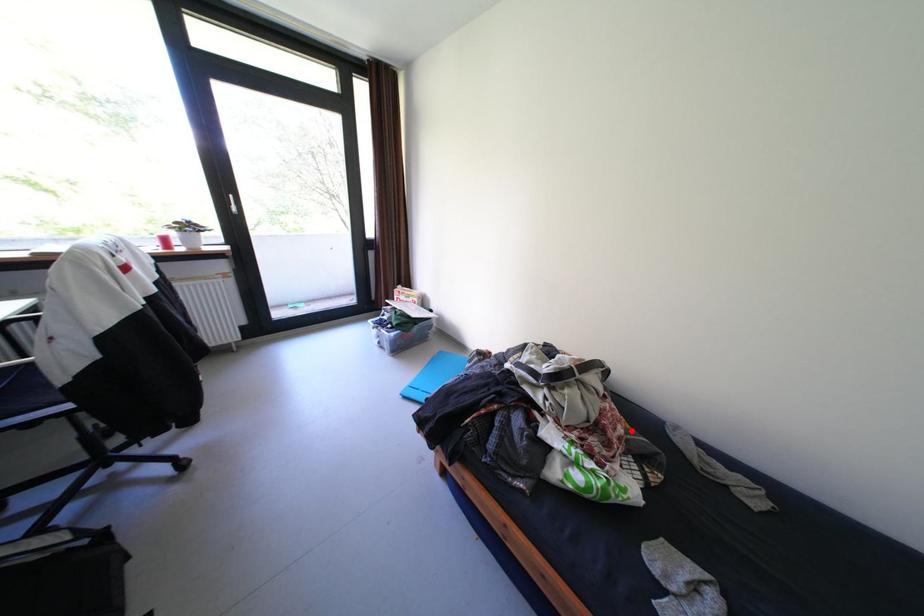
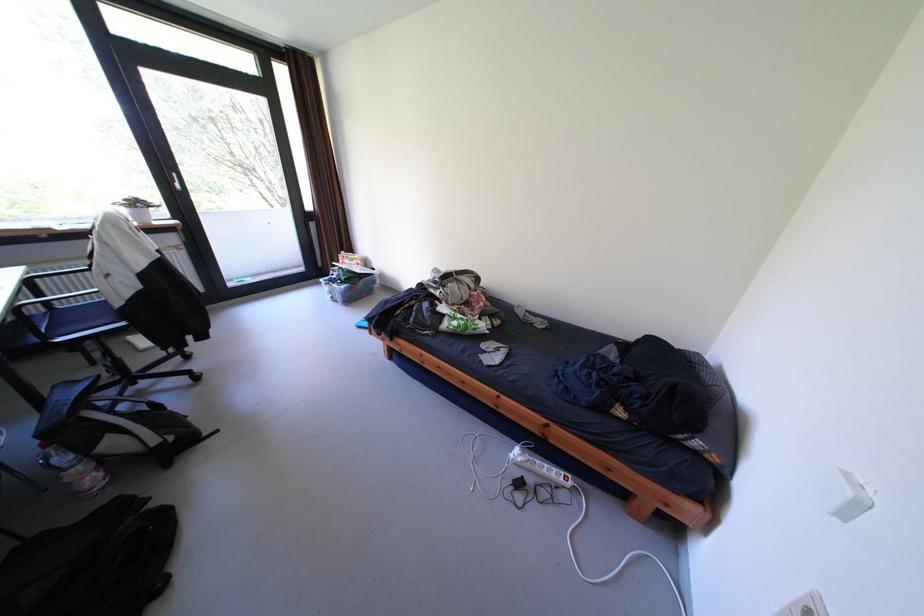
Locate, in the second image, the point that corresponds to the highlighted location in the first image.

(492, 304)